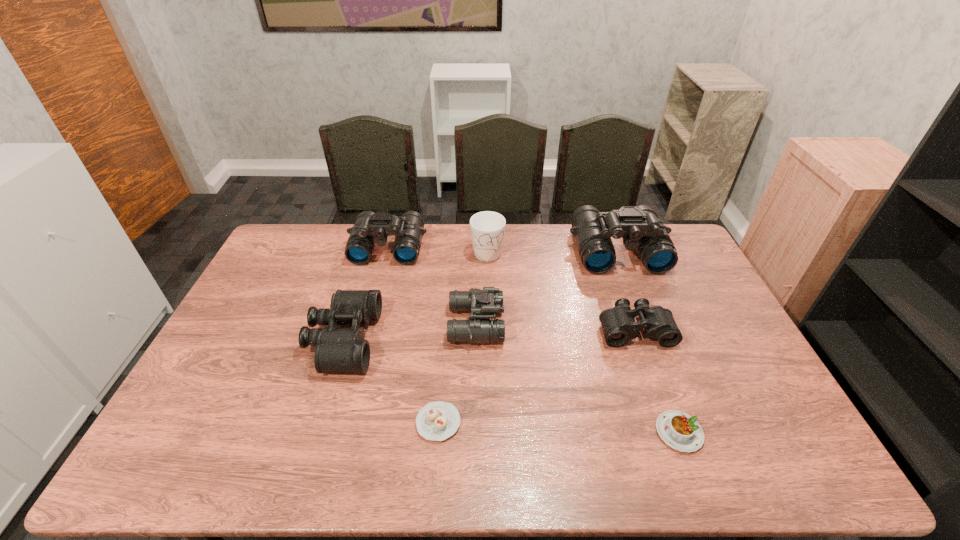
Locate an element on the screen. unoccupied position between the mug and the left black binoculars is located at coordinates (416, 295).

Locate an element on the screen. The image size is (960, 540). free spot between the fourth shortest binoculars and the cupcake is located at coordinates point(413,335).

I want to click on free point between the biggest blue binoculars and the shortest binoculars, so click(x=626, y=290).

This screenshot has height=540, width=960. What are the coordinates of `vacant point located between the sixth tallest object and the fourth shortest binoculars` in the screenshot? It's located at (512, 288).

This screenshot has height=540, width=960. What are the coordinates of `vacant region between the sixth tallest object and the tallest object` in the screenshot? It's located at (x=626, y=290).

Where is `vacant space in between the pudding and the nearest blue binoculars`? The image size is (960, 540). vacant space in between the pudding and the nearest blue binoculars is located at coordinates pyautogui.click(x=578, y=378).

Where is `vacant area that lies between the nearest blue binoculars and the bigger black binoculars`? The image size is (960, 540). vacant area that lies between the nearest blue binoculars and the bigger black binoculars is located at coordinates (410, 332).

Identify the location of vacant space that is in between the left black binoculars and the cupcake. (391, 381).

This screenshot has width=960, height=540. Find the location of `empty space between the cupcake and the right black binoculars`. empty space between the cupcake and the right black binoculars is located at coordinates (537, 376).

Select which object is the closest to the left black binoculars. Please provide its 2D coordinates. Your answer should be formatted as a tuple, i.e. [(x, y)], where the tuple contains the x and y coordinates of a point satisfying the conditions above.

[(437, 421)]